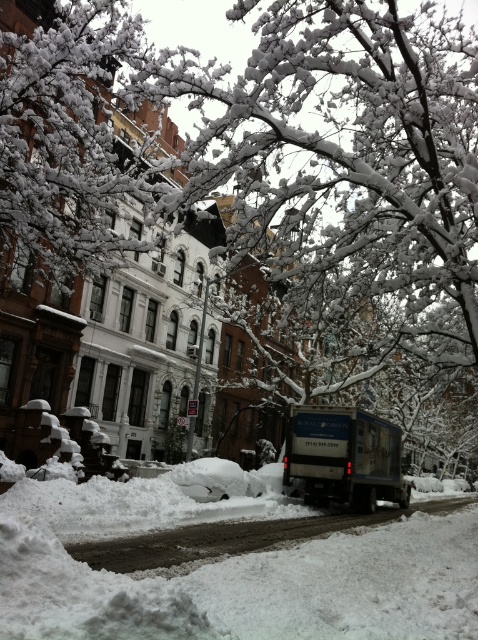
Question: Which point is closer to the camera?

Choices:
 (A) (384, 636)
 (B) (371, 432)

Answer: (A)

Question: Does white fluffy snow at lower left appear on the left side of blue metallic truck at center?

Choices:
 (A) no
 (B) yes

Answer: (B)

Question: Which of the following is the farthest from the observer?

Choices:
 (A) (340, 544)
 (B) (351, 481)

Answer: (B)

Question: Observing the image, what is the correct spatial positioning of white fluffy snow at lower left in reference to blue metallic truck at center?

Choices:
 (A) right
 (B) left

Answer: (B)

Question: Does white fluffy snow at lower left appear under blue metallic truck at center?

Choices:
 (A) yes
 (B) no

Answer: (B)